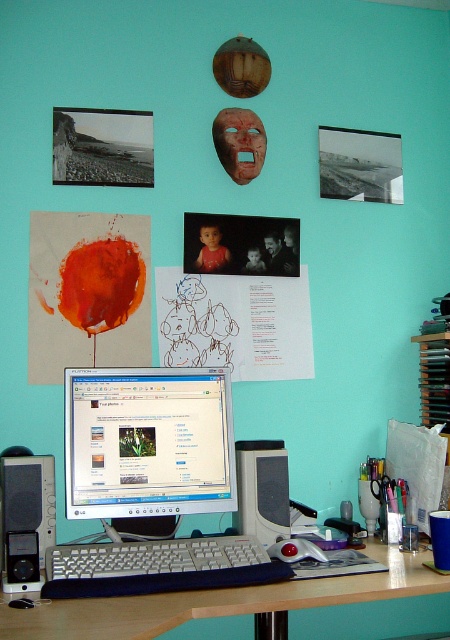
Can you confirm if wooden at center is thinner than black plastic speaker at center?

No.

Does wooden at center appear on the right side of black plastic speaker at center?

No, wooden at center is not to the right of black plastic speaker at center.

Is point (432, 589) positioned before point (235, 513)?

Yes, it is.

Image resolution: width=450 pixels, height=640 pixels. What are the coordinates of `wooden at center` in the screenshot? It's located at (219, 602).

Does point (166, 381) come in front of point (306, 552)?

No, (166, 381) is behind (306, 552).

Is white plastic monitor at center shorter than rubberized black mouse at center?

No, white plastic monitor at center is not shorter than rubberized black mouse at center.

I want to click on white plastic monitor at center, so click(x=148, y=442).

You are a GUI agent. You are given a task and a screenshot of the screen. Output one action in this format:
    pyautogui.click(x=<x>, y=<y>)
    Task: Click on the white plastic monitor at center
    
    Given the screenshot: What is the action you would take?
    pyautogui.click(x=148, y=442)

Does white plastic monitor at center appear over wooden at center?

Indeed, white plastic monitor at center is positioned over wooden at center.

Is white plastic monitor at center closer to the viewer compared to wooden at center?

No, white plastic monitor at center is behind wooden at center.

The width and height of the screenshot is (450, 640). Find the location of `white plastic monitor at center`. white plastic monitor at center is located at coordinates [x=148, y=442].